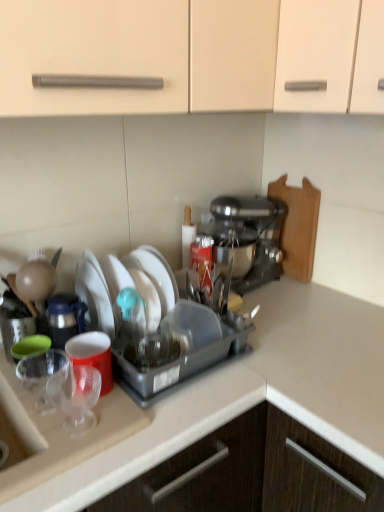
Question: From the image's perspective, would you say wooden cutting board at right is shown under white matte plate at center, arranged as the 2th tableware when ordered from the bottom?

Choices:
 (A) no
 (B) yes

Answer: (A)

Question: Does wooden cutting board at right have a lesser height compared to white matte plate at center, the 1th tableware in the top-to-bottom sequence?

Choices:
 (A) yes
 (B) no

Answer: (B)

Question: Is the position of wooden cutting board at right less distant than that of white matte plate at center, the second tableware when ordered from front to back?

Choices:
 (A) no
 (B) yes

Answer: (A)

Question: Is wooden cutting board at right taller than white matte plate at center, arranged as the 2th tableware when ordered from the bottom?

Choices:
 (A) no
 (B) yes

Answer: (B)

Question: From a real-world perspective, is wooden cutting board at right on top of white matte plate at center, arranged as the 2th tableware when ordered from the bottom?

Choices:
 (A) yes
 (B) no

Answer: (A)

Question: Based on their sizes in the image, would you say transparent plastic cup at lower left, the 1th tableware from the bottom, is bigger or smaller than matte plastic cup at left?

Choices:
 (A) big
 (B) small

Answer: (B)

Question: Is transparent plastic cup at lower left, placed as the 2th tableware when sorted from top to bottom, wider or thinner than matte plastic cup at left?

Choices:
 (A) thin
 (B) wide

Answer: (A)

Question: From a real-world perspective, is transparent plastic cup at lower left, which ranks as the 1th tableware in front-to-back order, above or below matte plastic cup at left?

Choices:
 (A) above
 (B) below

Answer: (B)

Question: Considering the positions of point (61, 370) and point (79, 364), is point (61, 370) closer or farther from the camera than point (79, 364)?

Choices:
 (A) farther
 (B) closer

Answer: (A)

Question: From a real-world perspective, relative to wooden cutting board at right, is matte plastic cup at left vertically above or below?

Choices:
 (A) below
 (B) above

Answer: (A)

Question: In terms of height, does matte plastic cup at left look taller or shorter compared to wooden cutting board at right?

Choices:
 (A) short
 (B) tall

Answer: (A)

Question: In the image, is matte plastic cup at left positioned in front of or behind wooden cutting board at right?

Choices:
 (A) behind
 (B) front

Answer: (B)

Question: From the image's perspective, is matte plastic cup at left located above or below wooden cutting board at right?

Choices:
 (A) above
 (B) below

Answer: (B)

Question: From the image's perspective, is white matte plate at center, the 1th tableware in the top-to-bottom sequence, positioned above or below wooden cutting board at right?

Choices:
 (A) below
 (B) above

Answer: (A)

Question: In terms of width, does white matte plate at center, the 1th tableware in the top-to-bottom sequence, look wider or thinner when compared to wooden cutting board at right?

Choices:
 (A) wide
 (B) thin

Answer: (A)